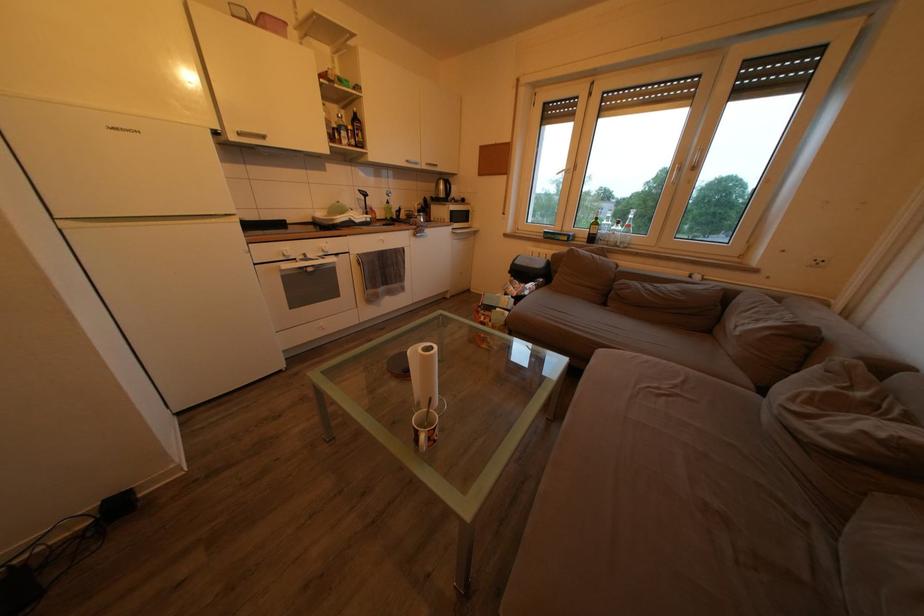
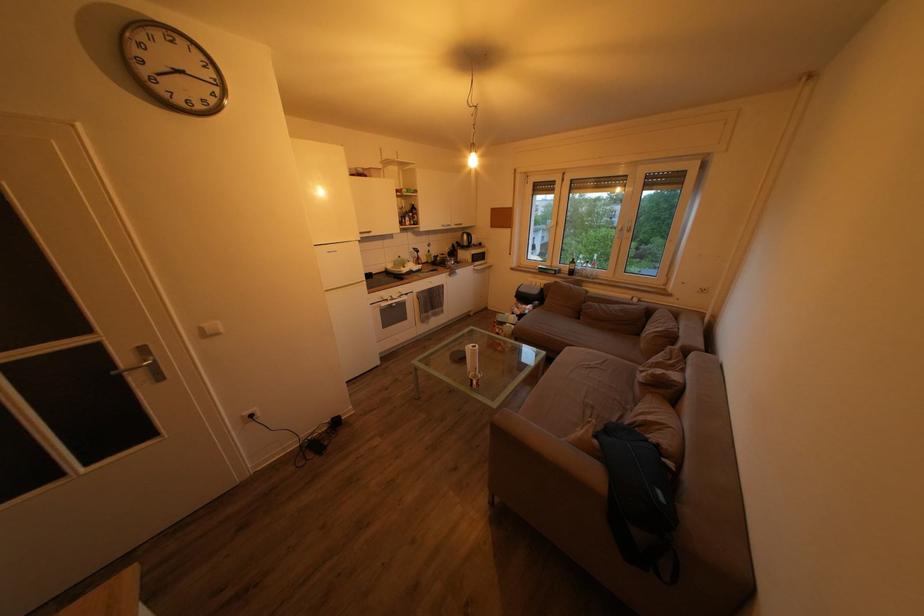
Where in the second image is the point corresponding to the point at 432,174 from the first image?

(462, 233)